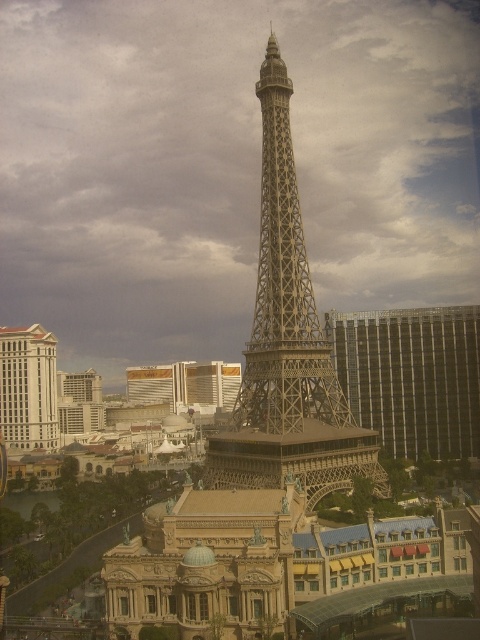
Is point (292, 224) more distant than point (87, 429)?

No, (292, 224) is closer to viewer.

Does metallic silver tower at center appear on the right side of metallic silver building at lower left?

Correct, you'll find metallic silver tower at center to the right of metallic silver building at lower left.

Locate an element on the screen. The width and height of the screenshot is (480, 640). metallic silver tower at center is located at coordinates (288, 346).

This screenshot has height=640, width=480. I want to click on metallic silver tower at center, so click(288, 346).

This screenshot has height=640, width=480. I want to click on metallic silver tower at center, so click(x=288, y=346).

Where is `metallic silver tower at center`? Image resolution: width=480 pixels, height=640 pixels. metallic silver tower at center is located at coordinates (288, 346).

Does metallic silver tower at center have a greater width compared to beige stone hotel at lower left?

Indeed, metallic silver tower at center has a greater width compared to beige stone hotel at lower left.

Measure the distance between point (239,417) and camera.

Point (239,417) and camera are 398.28 feet apart from each other.

Is point (247, 460) closer to camera compared to point (44, 332)?

Yes, it is in front of point (44, 332).

Where is `metallic silver tower at center`? This screenshot has height=640, width=480. metallic silver tower at center is located at coordinates (288, 346).